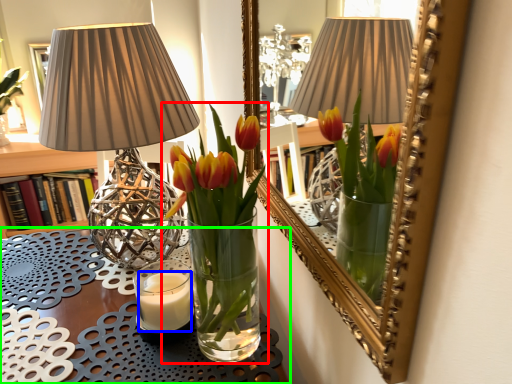
Question: Which is nearer to the houseplant (highlighted by a red box)? candle (highlighted by a blue box) or table (highlighted by a green box).

Choices:
 (A) candle
 (B) table

Answer: (A)